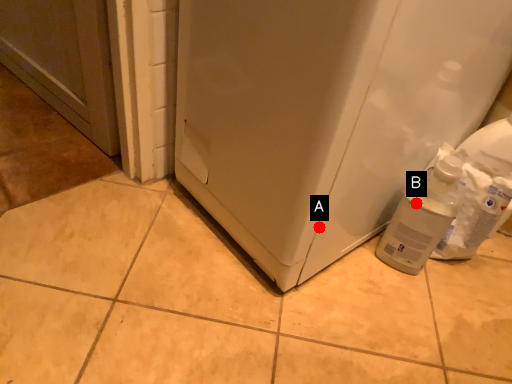
Question: Two points are circled on the image, labeled by A and B beside each circle. Which point appears closest to the camera in this image?

Choices:
 (A) A is closer
 (B) B is closer

Answer: (A)